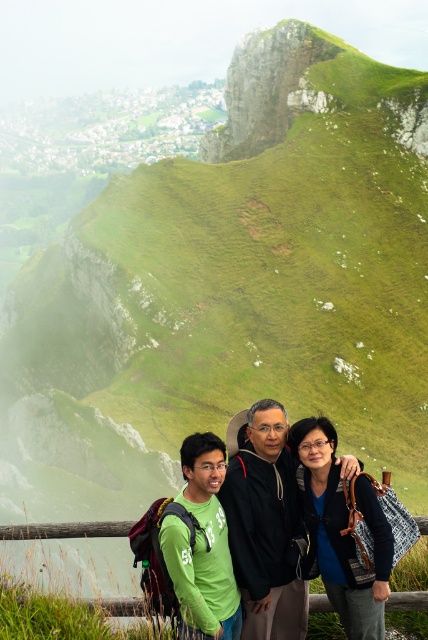
You are a photographer trying to capture a clear shot of both the green matte shirt at lower center and the green matte shirt at lower left. Since they are overlapping, which one is covering the other?

The green matte shirt at lower center is positioned over the green matte shirt at lower left, meaning it is covering the one at lower left.

In the scene shown: You are standing at the viewpoint and want to take a photo of the two points marked in the scene. Which point is closer to you, point (x=379, y=544) or point (x=199, y=595)?

Point (x=379, y=544) is closer to the viewer than point (x=199, y=595).